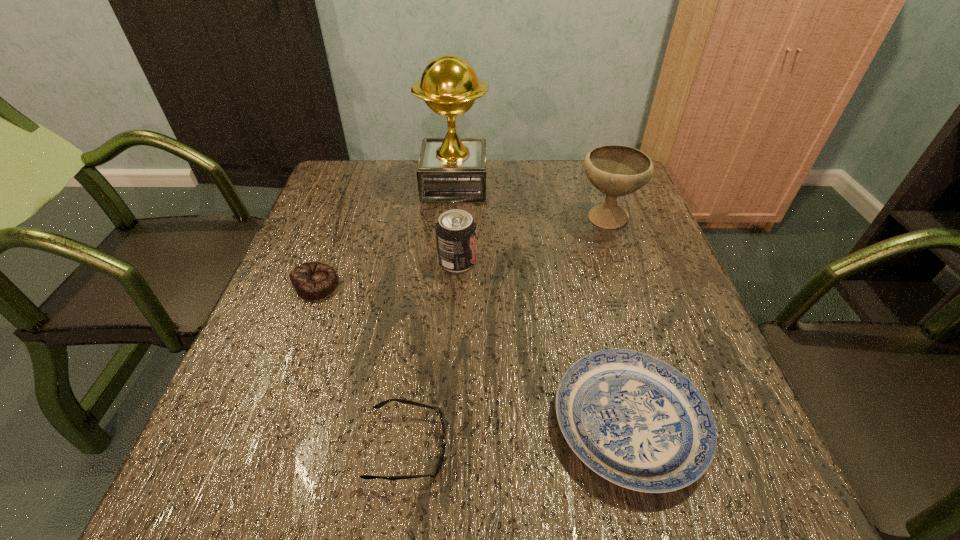
Locate an element on the screen. The height and width of the screenshot is (540, 960). vacant space that is in between the soda can and the plate is located at coordinates [x=543, y=342].

Identify the location of unoccupied position between the plate and the third tallest object. This screenshot has width=960, height=540. (543, 342).

Identify the location of free spot between the third tallest object and the second tallest object. (532, 240).

The image size is (960, 540). What are the coordinates of `vacant area that lies between the tallest object and the leftmost object` in the screenshot? It's located at (386, 234).

Locate an element on the screen. The width and height of the screenshot is (960, 540). vacant point located between the fifth shortest object and the sunglasses is located at coordinates (507, 333).

Point out which object is positioned as the third nearest to the soda can. Please provide its 2D coordinates. Your answer should be formatted as a tuple, i.e. [(x, y)], where the tuple contains the x and y coordinates of a point satisfying the conditions above.

[(616, 170)]

What are the coordinates of `object that is the fourth nearest to the soda can` in the screenshot? It's located at (635, 420).

Locate an element on the screen. Image resolution: width=960 pixels, height=540 pixels. vacant area in the image that satisfies the following two spatial constraints: 1. on the front side of the plate; 2. on the lenses of the sunglasses is located at coordinates (636, 447).

Locate an element on the screen. free space that satisfies the following two spatial constraints: 1. on the back side of the plate; 2. on the front-facing side of the award is located at coordinates (566, 184).

Find the location of a particular element. Image resolution: width=960 pixels, height=540 pixels. vacant area in the image that satisfies the following two spatial constraints: 1. on the back side of the soda can; 2. on the front-facing side of the award is located at coordinates (462, 184).